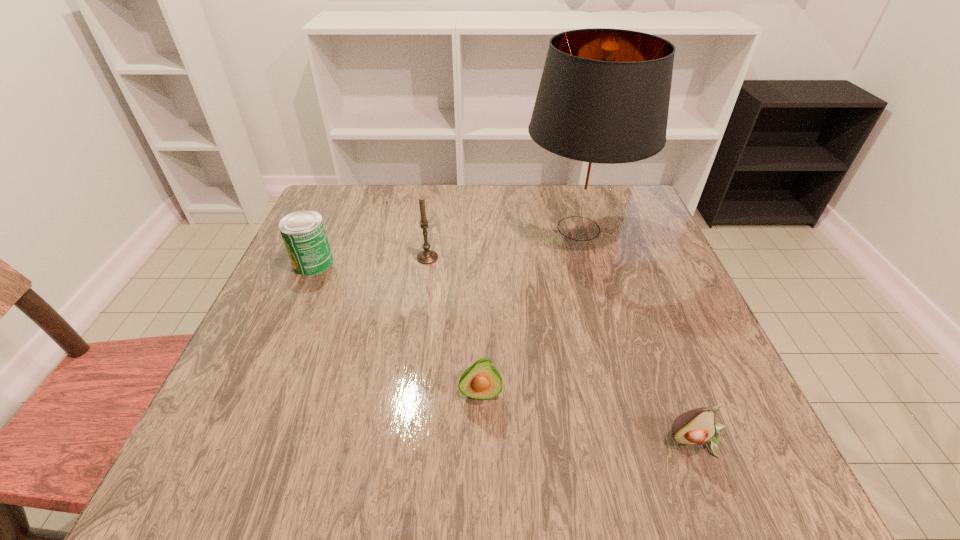
Find the location of a particular element. The height and width of the screenshot is (540, 960). vacant space at the left edge of the desktop is located at coordinates (322, 286).

Where is `vacant space at the right edge of the desktop`? Image resolution: width=960 pixels, height=540 pixels. vacant space at the right edge of the desktop is located at coordinates point(745,421).

This screenshot has height=540, width=960. In order to click on vacant space at the far left corner of the desktop in this screenshot , I will do `click(342, 192)`.

The image size is (960, 540). I want to click on vacant space at the near left corner of the desktop, so pyautogui.click(x=193, y=463).

Image resolution: width=960 pixels, height=540 pixels. What are the coordinates of `free space at the far right corner of the desktop` in the screenshot? It's located at (640, 205).

You are a GUI agent. You are given a task and a screenshot of the screen. Output one action in this format:
    pyautogui.click(x=<x>, y=<y>)
    Task: Click on the empty location between the nearer avocado and the tallest object
    The width and height of the screenshot is (960, 540).
    Given the screenshot: What is the action you would take?
    pyautogui.click(x=637, y=335)

The image size is (960, 540). Identify the location of free space between the leftmost object and the nearest object. (505, 352).

The height and width of the screenshot is (540, 960). In order to click on vacant area between the can and the nearest object in this screenshot , I will do pyautogui.click(x=505, y=352).

Locate an element on the screen. The image size is (960, 540). free space between the farther avocado and the lampshade is located at coordinates (530, 310).

Where is `empty space that is in between the can and the nearest object`? The image size is (960, 540). empty space that is in between the can and the nearest object is located at coordinates (505, 352).